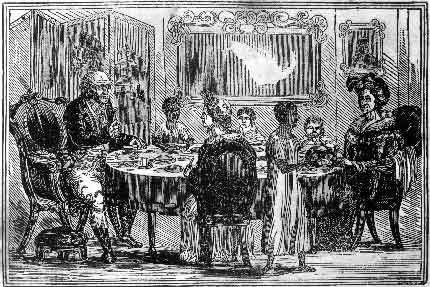
The width and height of the screenshot is (430, 287). I want to click on table, so click(x=150, y=172).